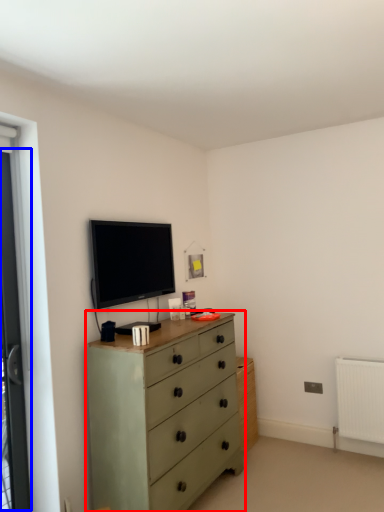
Question: Which point is closer to the camera, chest of drawers (highlighted by a red box) or screen door (highlighted by a blue box)?

Choices:
 (A) chest of drawers
 (B) screen door

Answer: (A)